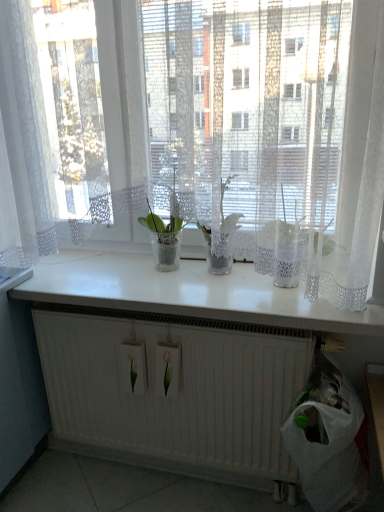
Image resolution: width=384 pixels, height=512 pixels. I want to click on vacant space underneath translucent glass vase at center (from a real-world perspective), so click(x=162, y=268).